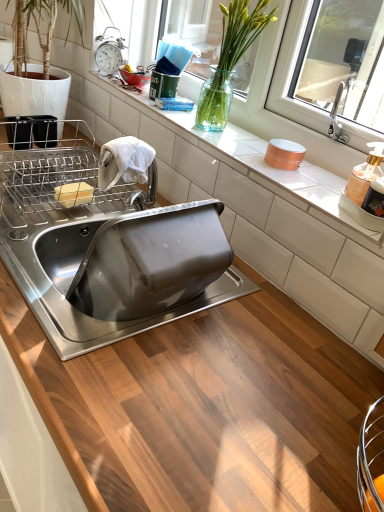
You are a GUI agent. You are given a task and a screenshot of the screen. Output one action in this format:
    pyautogui.click(x=<x>, y=<y>)
    Task: Click on the vacant area that is in front of yellow butter at upper left
    
    Given the screenshot: What is the action you would take?
    pyautogui.click(x=47, y=222)